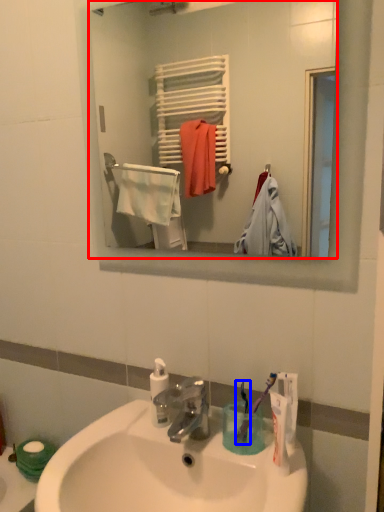
Question: Which object is closer to the camera taking this photo, mirror (highlighted by a red box) or toothbrush (highlighted by a blue box)?

Choices:
 (A) mirror
 (B) toothbrush

Answer: (A)